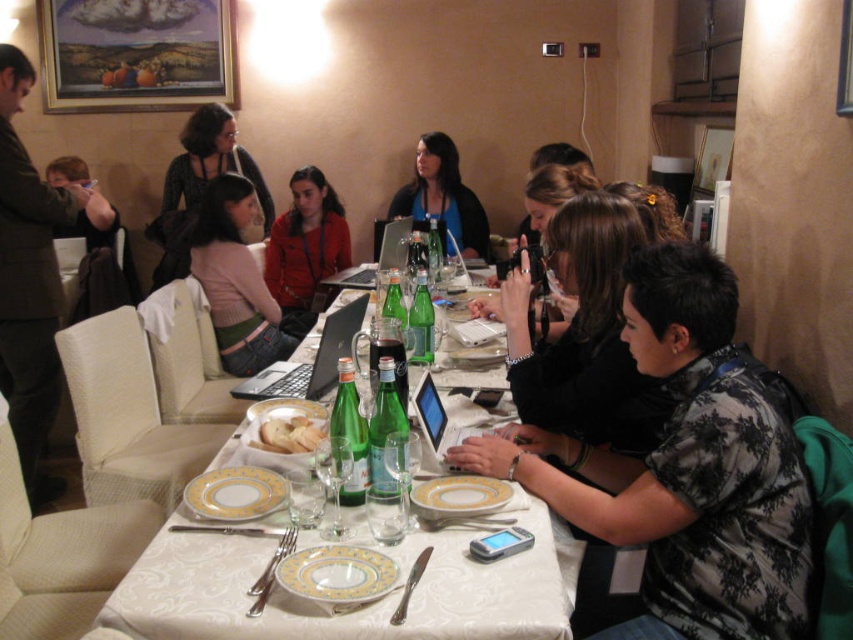
Does matte black jacket at center have a greater width compared to white plastic laptop at center?

Yes, matte black jacket at center is wider than white plastic laptop at center.

Which of these two, matte black jacket at center or white plastic laptop at center, stands taller?

Standing taller between the two is matte black jacket at center.

Describe the element at coordinates (444, 196) in the screenshot. I see `matte black jacket at center` at that location.

Find the location of a particular element. The image size is (853, 640). matte black jacket at center is located at coordinates (444, 196).

Who is more distant from viewer, (183,147) or (202,515)?

The point (183,147) is behind.

The height and width of the screenshot is (640, 853). I want to click on matte black sweater at upper center, so click(x=199, y=186).

Can you confirm if matte black laptop at left is smaller than matte black sweater at upper center?

Incorrect, matte black laptop at left is not smaller in size than matte black sweater at upper center.

Which of these two, matte black laptop at left or matte black sweater at upper center, stands taller?

matte black laptop at left is taller.

This screenshot has width=853, height=640. In order to click on matte black laptop at left in this screenshot , I will do `click(28, 282)`.